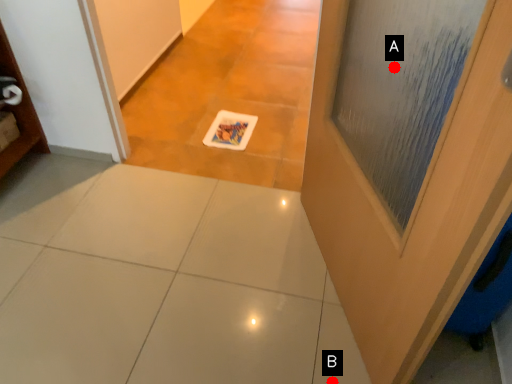
Question: Two points are circled on the image, labeled by A and B beside each circle. Which point is closer to the camera?

Choices:
 (A) A is closer
 (B) B is closer

Answer: (B)